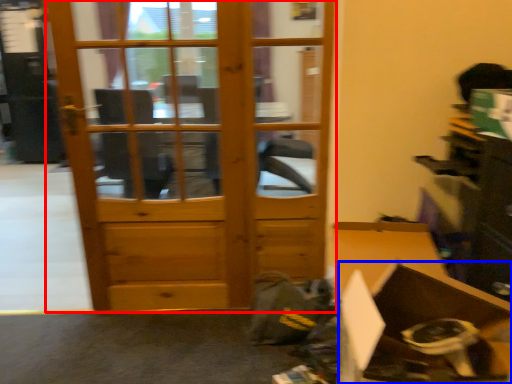
Question: Which object appears farthest to the camera in this image, door (highlighted by a red box) or cardboard box (highlighted by a blue box)?

Choices:
 (A) door
 (B) cardboard box

Answer: (A)